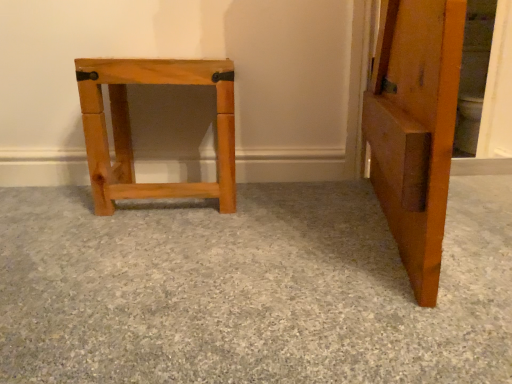
Question: Considering the positions of point (122, 352) and point (117, 64), is point (122, 352) closer or farther from the camera than point (117, 64)?

Choices:
 (A) closer
 (B) farther

Answer: (A)

Question: Looking at their shapes, would you say natural wood stool at left is wider or thinner than natural wood stool at center?

Choices:
 (A) wide
 (B) thin

Answer: (A)

Question: Considering the relative positions of natural wood stool at left and natural wood stool at center in the image provided, is natural wood stool at left to the left or to the right of natural wood stool at center?

Choices:
 (A) right
 (B) left

Answer: (A)

Question: Considering the positions of natural wood stool at center and natural wood stool at left in the image, is natural wood stool at center wider or thinner than natural wood stool at left?

Choices:
 (A) wide
 (B) thin

Answer: (B)

Question: Relative to natural wood stool at left, is natural wood stool at center in front or behind?

Choices:
 (A) behind
 (B) front

Answer: (A)

Question: Is natural wood stool at center taller or shorter than natural wood stool at left?

Choices:
 (A) short
 (B) tall

Answer: (B)

Question: Would you say natural wood stool at center is inside or outside natural wood stool at left?

Choices:
 (A) outside
 (B) inside

Answer: (A)